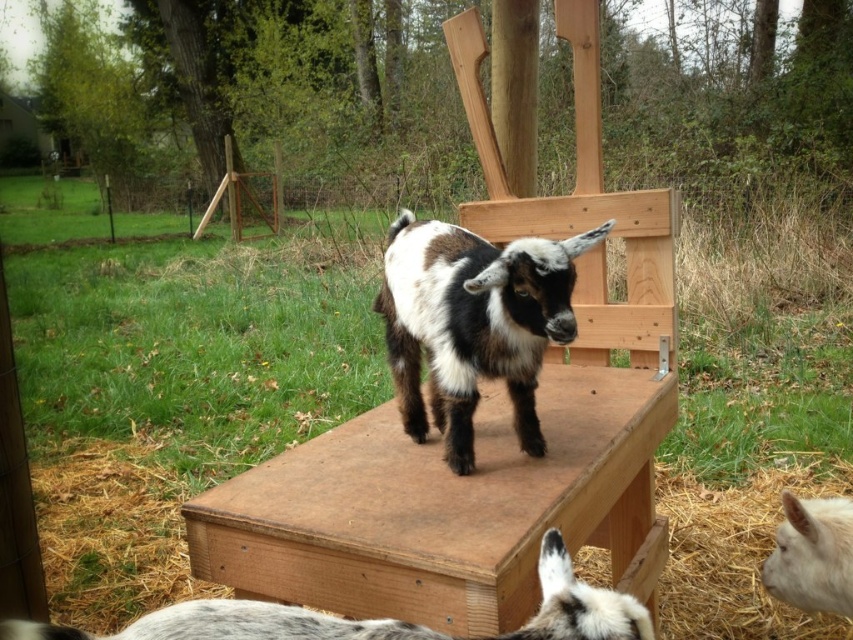
You are standing in the backyard and want to feed both goats. The spotted fur goat at center and the white speckled fur goat at lower center are in your view. Which goat should you approach first if you want to reach the one closer to the left side first?

The white speckled fur goat at lower center is closer to the left side, so you should approach it first.

You are a farmer checking the condition of your animals. You notice the spotted fur goat at center and the straw at lower right. Which object is smaller in size?

The spotted fur goat at center is smaller in size compared to the straw at lower right.

You are a farmer checking on your goats in the backyard. You notice the spotted fur goat at center and the white speckled fur goat at lower center. Which goat is closer to you?

The spotted fur goat at center is closer to you because the white speckled fur goat at lower center is behind it.